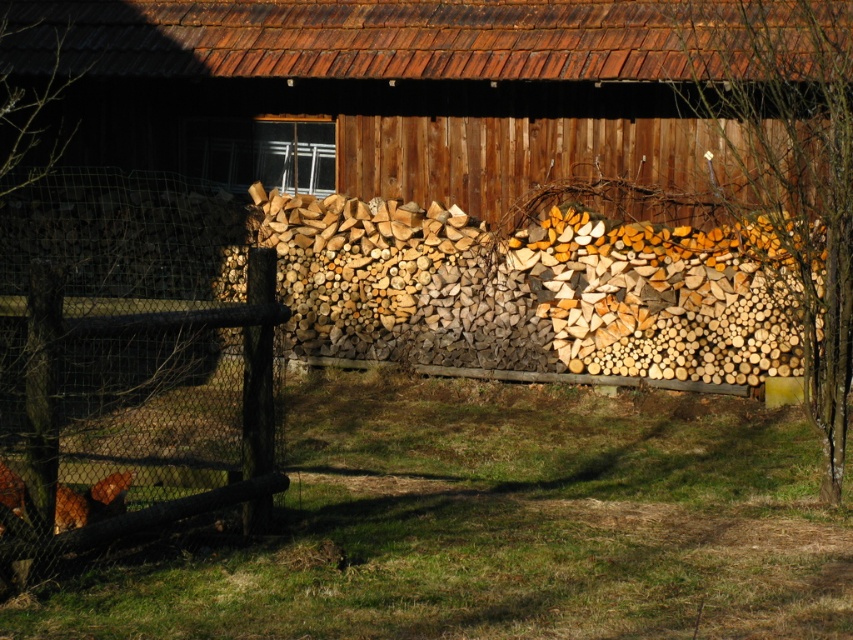
You are planning to place a new bench in this outdoor area. The bench requires a space wider than the brown wooden fence at left. Can the wooden at center provide enough space for the bench?

The wooden at center has a larger width than the brown wooden fence at left, so it can provide enough space for the bench.

You are standing in front of a rustic wooden building with a stack of firewood. There is a point marked at coordinates (447, 92). What is located at this point?

The point at coordinates (447, 92) indicates wooden at center.